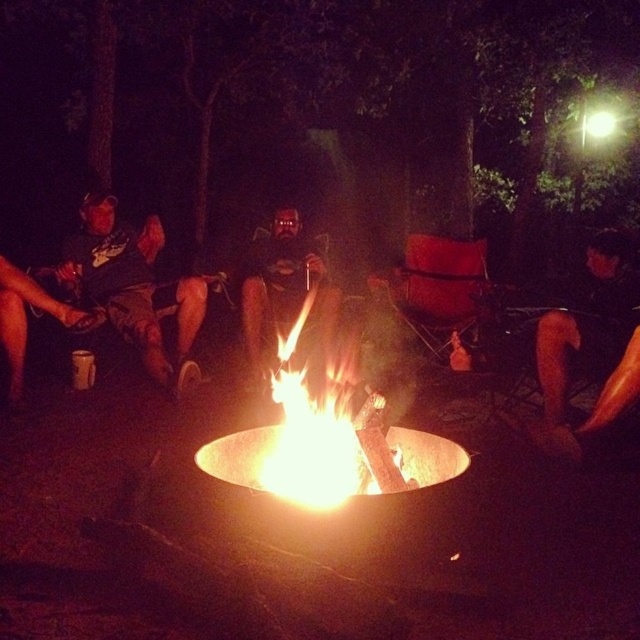
You are standing in front of the campfire scene. There are two points marked in the image at coordinates point [627,266] and point [1,337]. If you want to touch both points with your finger, which point should you reach for first?

You should reach for point [627,266] first because it is closer to you than point [1,337].